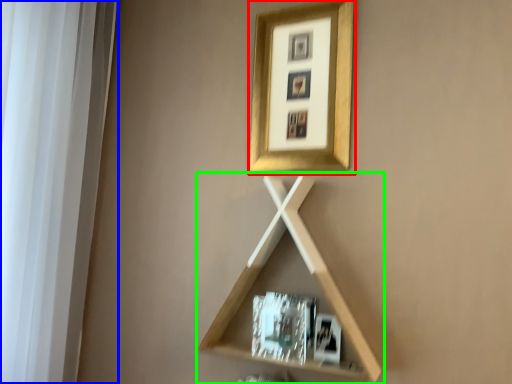
Question: Based on their relative distances, which object is farther from picture frame (highlighted by a red box)? Choose from window frame (highlighted by a blue box) and shelf (highlighted by a green box).

Choices:
 (A) window frame
 (B) shelf

Answer: (A)